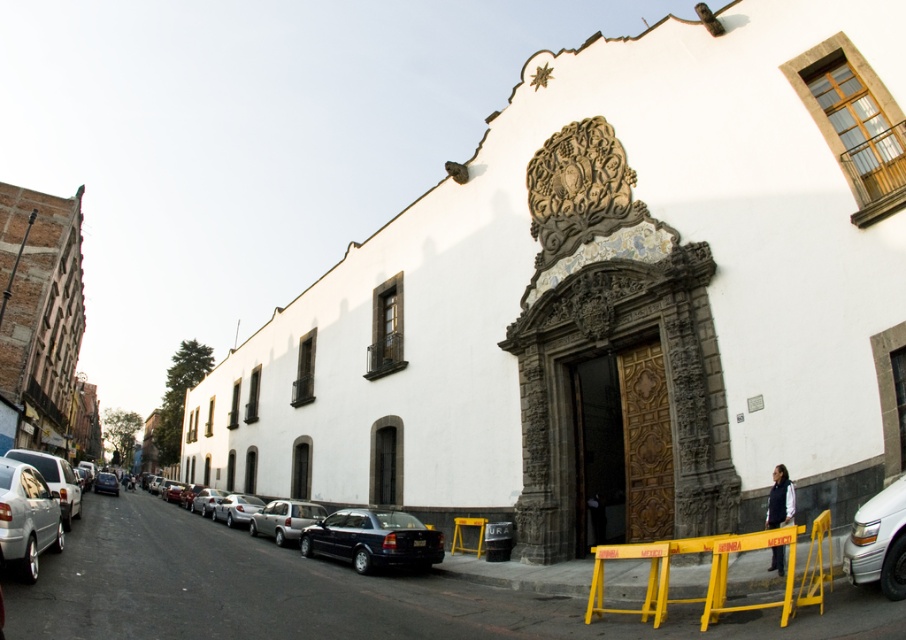
Question: Estimate the real-world distances between objects in this image. Which object is farther from the silver metallic van at left?

Choices:
 (A) yellow plastic barricade at lower center
 (B) white glossy sedan at lower right
 (C) shiny black sedan at center

Answer: (B)

Question: Is yellow plastic barricade at lower center wider than shiny black sedan at center-left?

Choices:
 (A) no
 (B) yes

Answer: (A)

Question: Can you confirm if shiny black sedan at center is smaller than satin silver car at center?

Choices:
 (A) yes
 (B) no

Answer: (A)

Question: Observing the image, what is the correct spatial positioning of silver metallic van at left in reference to satin silver car at center?

Choices:
 (A) below
 (B) above

Answer: (B)

Question: Which is farther from the shiny black sedan at center-left?

Choices:
 (A) silver metallic van at left
 (B) shiny black sedan at center
 (C) white glossy sedan at lower right
 (D) yellow plastic barricade at lower center

Answer: (C)

Question: Which object is positioned farthest from the shiny black sedan at center?

Choices:
 (A) satin silver car at center
 (B) shiny black sedan at center-left

Answer: (A)